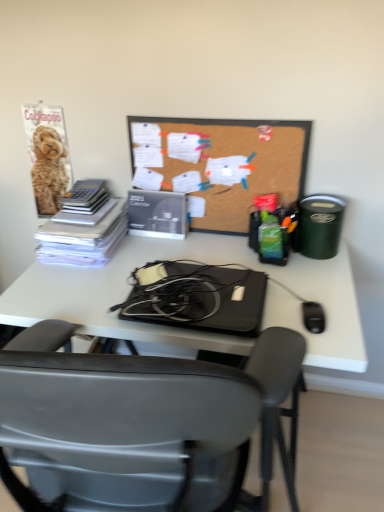
At what (x,y) coordinates should I click in order to perform the action: click on vacant space that is in between black plastic mouse at lower right and black matte laptop at center. Please return your answer as a coordinate pair (x, y). The height and width of the screenshot is (512, 384). Looking at the image, I should click on (292, 307).